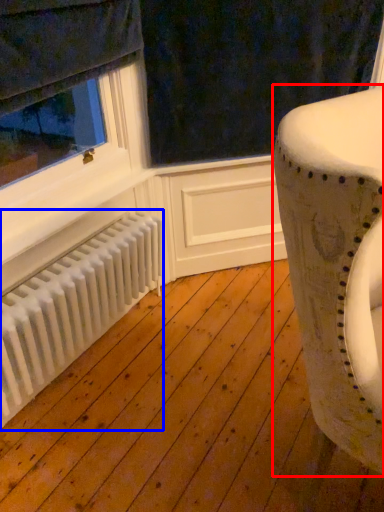
Question: Which object appears farthest to the camera in this image, furniture (highlighted by a red box) or radiator (highlighted by a blue box)?

Choices:
 (A) furniture
 (B) radiator

Answer: (B)